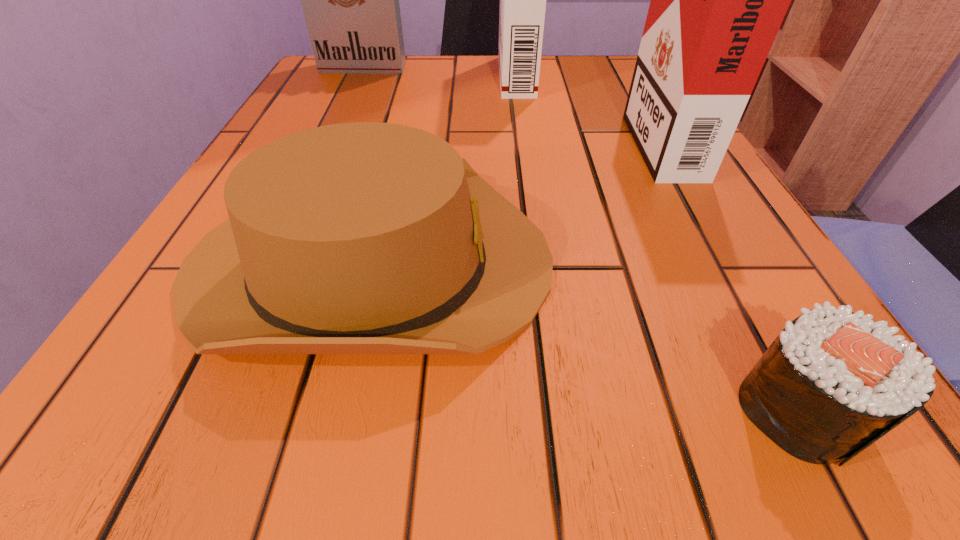
Locate an element on the screen. object that is at the near right corner is located at coordinates (832, 383).

Find the location of a particular element. The width and height of the screenshot is (960, 540). free space at the far edge is located at coordinates (574, 75).

You are a GUI agent. You are given a task and a screenshot of the screen. Output one action in this format:
    pyautogui.click(x=<x>, y=<y>)
    Task: Click on the vacant space at the near edge of the desktop
    The image size is (960, 540).
    Given the screenshot: What is the action you would take?
    pyautogui.click(x=462, y=431)

Image resolution: width=960 pixels, height=540 pixels. I want to click on vacant space at the left edge, so click(x=136, y=374).

Locate an element on the screen. This screenshot has width=960, height=540. free space at the right edge of the desktop is located at coordinates tap(625, 170).

Identify the location of vacant point at the far left corner. The width and height of the screenshot is (960, 540). (307, 90).

I want to click on vacant space at the far right corner of the desktop, so click(x=582, y=73).

Image resolution: width=960 pixels, height=540 pixels. I want to click on free space that is in between the shortest object and the second cigarette case from right to left, so click(658, 242).

Where is `vacant area that lies between the shortest object and the nearest cigarette case`? The width and height of the screenshot is (960, 540). vacant area that lies between the shortest object and the nearest cigarette case is located at coordinates (729, 274).

The height and width of the screenshot is (540, 960). In order to click on vacant space that's between the rightmost cigarette case and the second cigarette case from right to left in this screenshot , I will do `click(588, 107)`.